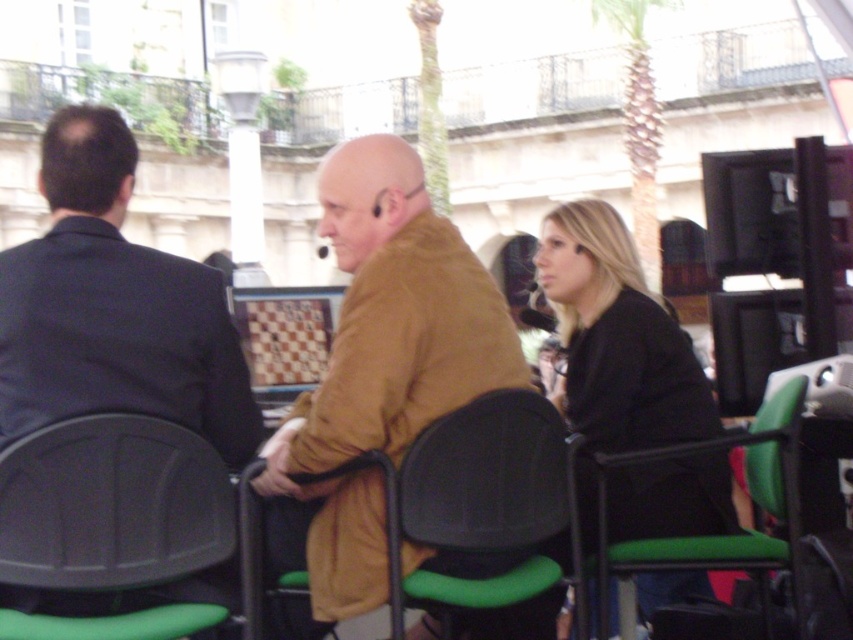
Question: Does brown leather jacket at center come in front of black matte jacket at center?

Choices:
 (A) no
 (B) yes

Answer: (B)

Question: Does black plastic chair at center have a larger size compared to green plastic chair at right?

Choices:
 (A) no
 (B) yes

Answer: (B)

Question: Is black matte jacket at center to the right of black plastic chair at center from the viewer's perspective?

Choices:
 (A) yes
 (B) no

Answer: (A)

Question: Which object is the farthest from the black plastic chair at center?

Choices:
 (A) green plastic chair at right
 (B) matte plastic chair at left

Answer: (A)

Question: Which point is closer to the camera?

Choices:
 (A) matte plastic chair at left
 (B) black matte jacket at center

Answer: (A)

Question: Which is farther from the black matte jacket at center?

Choices:
 (A) brown leather jacket at center
 (B) dark blue suit at left
 (C) green plastic chair at right

Answer: (B)